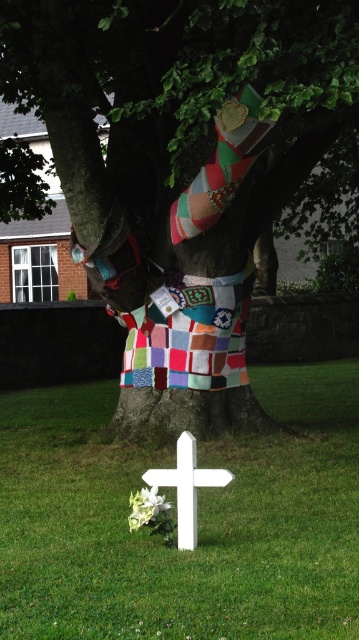
Which is above, patchwork quilted tree trunk at center or green grass at lower center?

patchwork quilted tree trunk at center

Identify the location of patchwork quilted tree trunk at center. (179, 163).

Is point (236, 236) more distant than point (238, 563)?

Yes, point (236, 236) is behind point (238, 563).

Find the location of a particular element. This screenshot has width=359, height=640. patchwork quilted tree trunk at center is located at coordinates (179, 163).

In the scene shown: Between patchwork quilted tree trunk at center and patchwork quilt at upper center, which one appears on the right side from the viewer's perspective?

patchwork quilted tree trunk at center

Can you confirm if patchwork quilted tree trunk at center is smaller than patchwork quilt at upper center?

Yes, patchwork quilted tree trunk at center is smaller than patchwork quilt at upper center.

You are a GUI agent. You are given a task and a screenshot of the screen. Output one action in this format:
    pyautogui.click(x=<x>, y=<y>)
    Task: Click on the patchwork quilted tree trunk at center
    The image size is (359, 640).
    Given the screenshot: What is the action you would take?
    pyautogui.click(x=179, y=163)

The image size is (359, 640). Find the location of `patchwork quilted tree trunk at center`. patchwork quilted tree trunk at center is located at coordinates (179, 163).

Can you confirm if green grass at lower center is positioned to the left of white matte cross at lower center?

Correct, you'll find green grass at lower center to the left of white matte cross at lower center.

Which is behind, point (268, 604) or point (216, 481)?

The point (216, 481) is behind.

Identify the location of green grass at lower center. (198, 522).